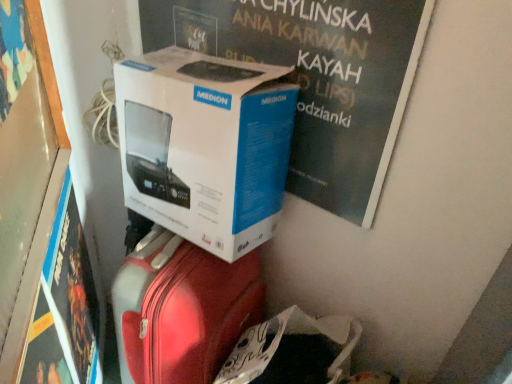
Question: Considering the relative positions of white cardboard box at center and white cardboard box at upper center, which is counted as the 2th magazine, starting from the left, in the image provided, is white cardboard box at center to the left or to the right of white cardboard box at upper center, which is counted as the 2th magazine, starting from the left,?

Choices:
 (A) left
 (B) right

Answer: (A)

Question: From a real-world perspective, relative to white cardboard box at upper center, arranged as the first magazine when viewed from the top, is white cardboard box at center vertically above or below?

Choices:
 (A) below
 (B) above

Answer: (A)

Question: Which of these objects is positioned farthest from the matte black magazine at lower left, which ranks as the first magazine in bottom-to-top order?

Choices:
 (A) wooden frame at left
 (B) white cardboard box at center
 (C) white cardboard box at upper center, which is counted as the 2th magazine, starting from the left

Answer: (C)

Question: Which is nearer to the white cardboard box at center?

Choices:
 (A) wooden frame at left
 (B) matte black magazine at lower left, which is the second magazine in top-to-bottom order
 (C) white cardboard box at upper center, positioned as the second magazine in bottom-to-top order

Answer: (C)